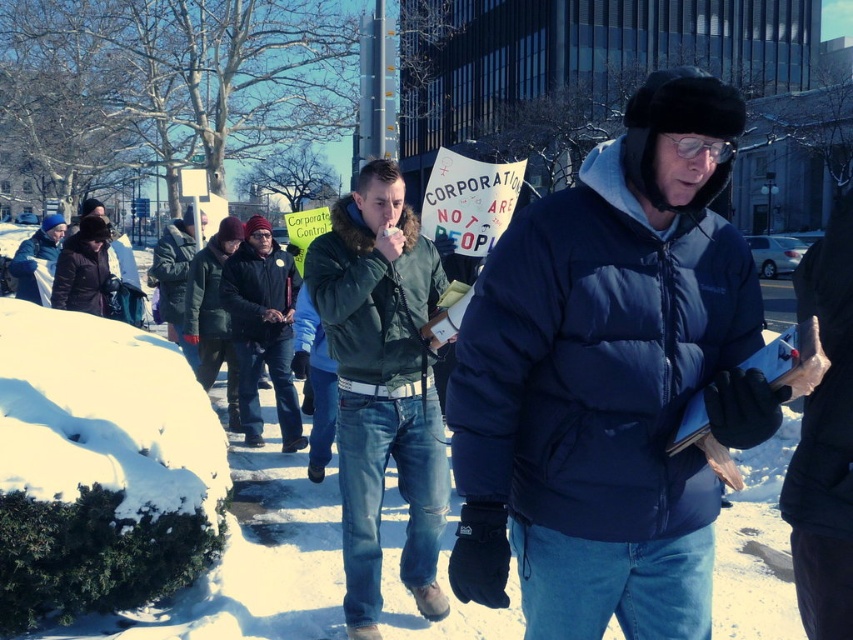
You are standing at the origin point of the coordinate system. You see two points in the image, point (231, 305) and point (39, 301). Which point is closer to you?

Point (39, 301) is closer to you because it has a smaller y coordinate than point (231, 305), which means it is positioned lower in the image and thus closer to the viewer.